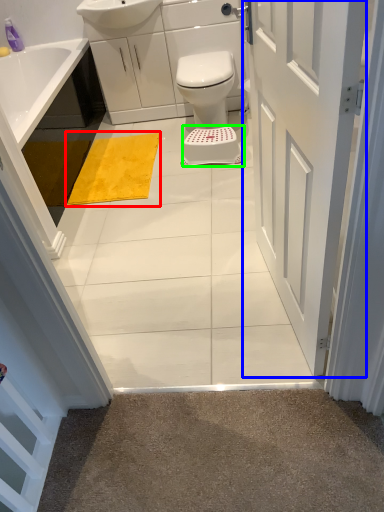
Question: Which is nearer to the bath mat (highlighted by a red box)? door (highlighted by a blue box) or stool (highlighted by a green box).

Choices:
 (A) door
 (B) stool

Answer: (B)